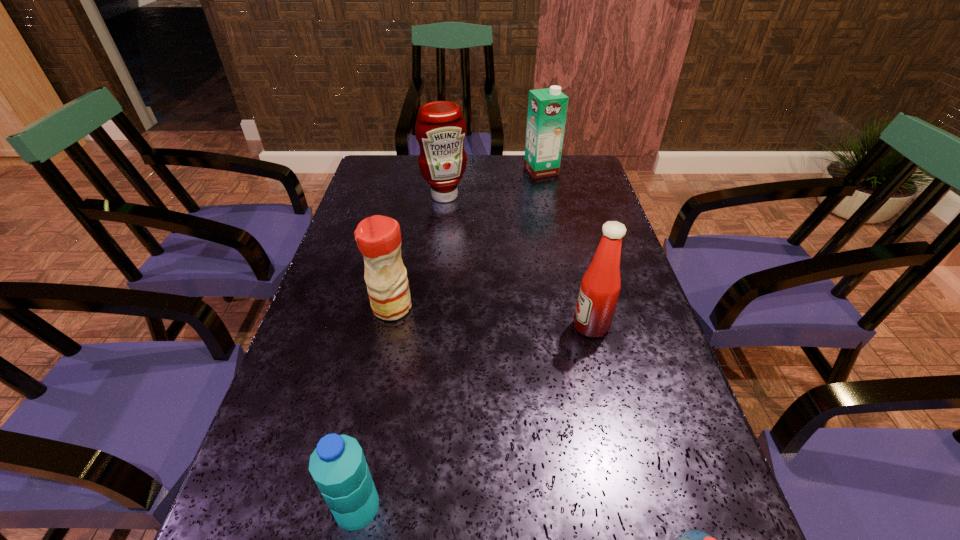
This screenshot has height=540, width=960. What are the coordinates of `vacant space located on the back of the taller water bottle` in the screenshot? It's located at (376, 404).

What are the coordinates of `condiment that is at the far edge` in the screenshot? It's located at (440, 129).

Identify the location of carton positioned at the far edge. The height and width of the screenshot is (540, 960). (547, 108).

The height and width of the screenshot is (540, 960). I want to click on condiment that is positioned at the left edge, so click(378, 237).

Locate an element on the screen. The image size is (960, 540). water bottle that is positioned at the left edge is located at coordinates (338, 466).

What are the coordinates of `carton positioned at the right edge` in the screenshot? It's located at (547, 108).

Locate an element on the screen. This screenshot has width=960, height=540. condiment present at the right edge is located at coordinates (601, 283).

The image size is (960, 540). Find the location of `object present at the far right corner`. object present at the far right corner is located at coordinates (547, 108).

Locate an element on the screen. This screenshot has height=540, width=960. blank area at the left edge is located at coordinates (266, 494).

In the image, there is a desktop. At what (x,y) coordinates should I click in order to perform the action: click on free space at the right edge. Please return your answer as a coordinate pair (x, y). Looking at the image, I should click on (636, 278).